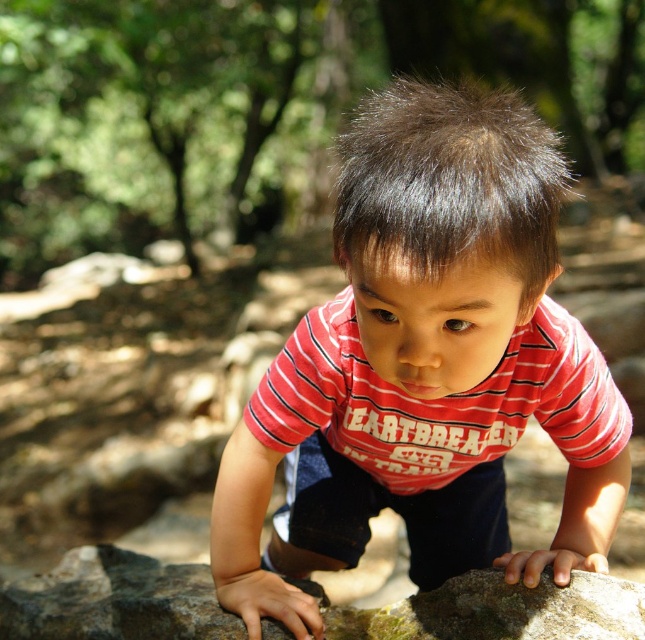
In the scene shown: Does red striped shirt at center have a lesser height compared to green mossy rock at center?

No.

Where is `red striped shirt at center`? The width and height of the screenshot is (645, 640). red striped shirt at center is located at coordinates (x=424, y=368).